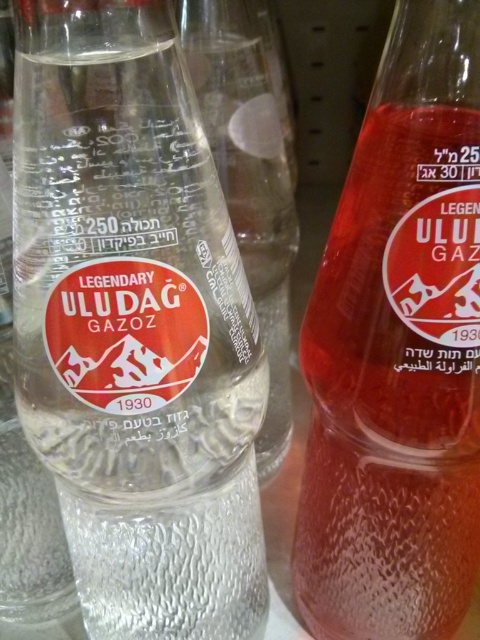
You are a delivery person who needs to locate the clear glass bottle at center on a store shelf. What are the coordinates where you should look?

The clear glass bottle at center is located at coordinates point (134,324).

You are a store employee who needs to arrange these two bottles on a narrow shelf that can only accommodate items up to 12 centimeters in width. The clear glass bottle at center and the translucent glass bottle at center are both candidates. Based on their sizes, which one should you choose to fit on the shelf?

The translucent glass bottle at center should be chosen because its width is smaller than the clear glass bottle at center, making it more likely to fit within the 12 centimeter width restriction.